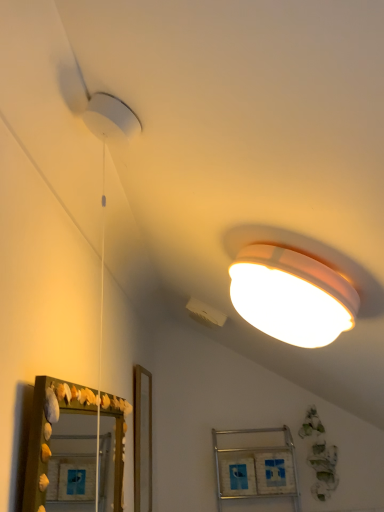
Question: Considering the positions of wooden mirror at lower left and metallic silver cabinet at lower center in the image, is wooden mirror at lower left bigger or smaller than metallic silver cabinet at lower center?

Choices:
 (A) small
 (B) big

Answer: (A)

Question: Considering the positions of wooden mirror at lower left and metallic silver cabinet at lower center in the image, is wooden mirror at lower left wider or thinner than metallic silver cabinet at lower center?

Choices:
 (A) wide
 (B) thin

Answer: (B)

Question: Is point (119, 494) closer or farther from the camera than point (253, 458)?

Choices:
 (A) farther
 (B) closer

Answer: (B)

Question: Is metallic silver cabinet at lower center inside or outside of wooden mirror at lower left?

Choices:
 (A) outside
 (B) inside

Answer: (A)

Question: Considering their positions, is metallic silver cabinet at lower center located in front of or behind wooden mirror at lower left?

Choices:
 (A) front
 (B) behind

Answer: (B)

Question: Considering the positions of metallic silver cabinet at lower center and wooden mirror at lower left in the image, is metallic silver cabinet at lower center taller or shorter than wooden mirror at lower left?

Choices:
 (A) short
 (B) tall

Answer: (B)

Question: From the image's perspective, is metallic silver cabinet at lower center above or below wooden mirror at lower left?

Choices:
 (A) above
 (B) below

Answer: (B)